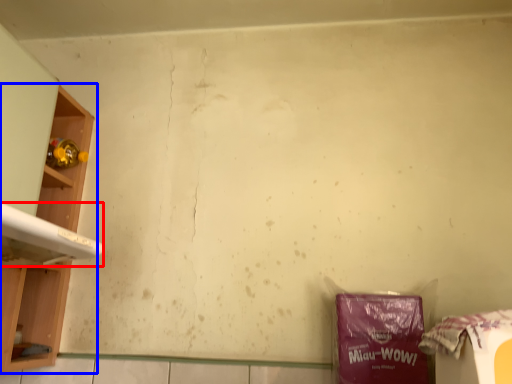
Question: Which of the following is the farthest to the observer, washing (highlighted by a red box) or shelf (highlighted by a blue box)?

Choices:
 (A) washing
 (B) shelf

Answer: (B)